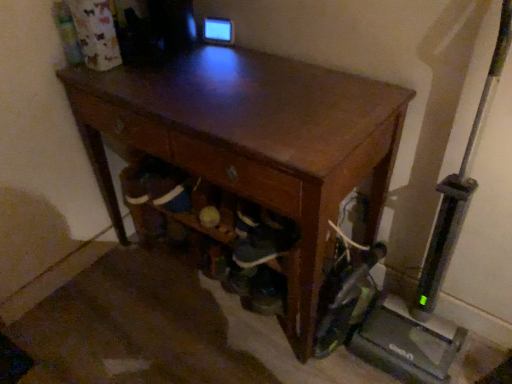
Find the location of a particular element. empty space that is ontop of shiny brown desk at center (from a real-world perspective) is located at coordinates (207, 86).